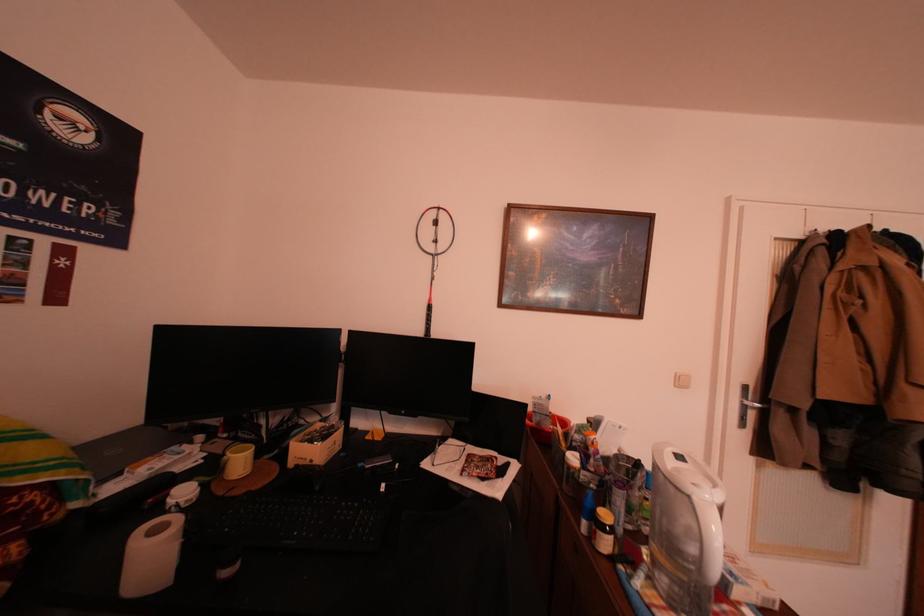
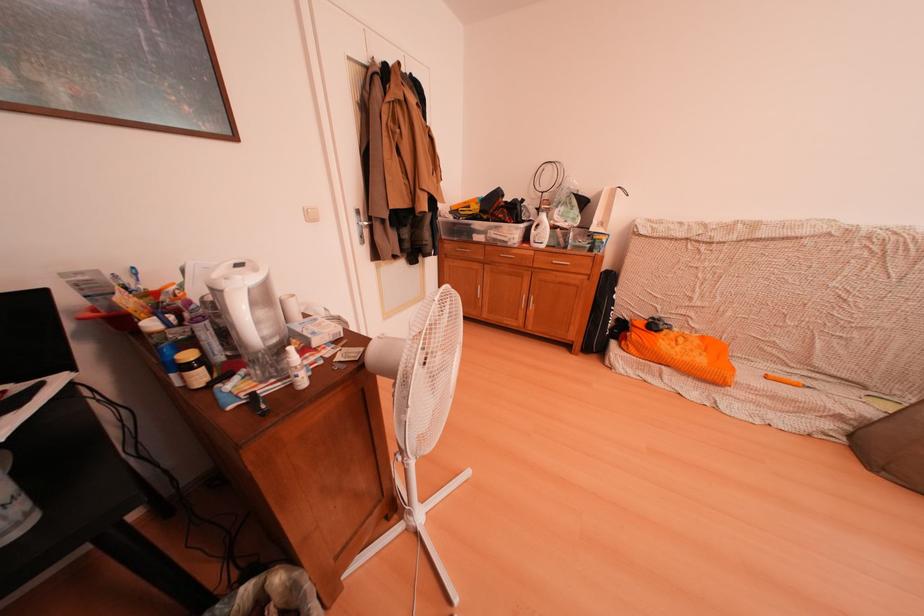
The first image is from the beginning of the video and the second image is from the end. How did the camera likely rotate when shooting the video?

The camera rotated toward right-down.